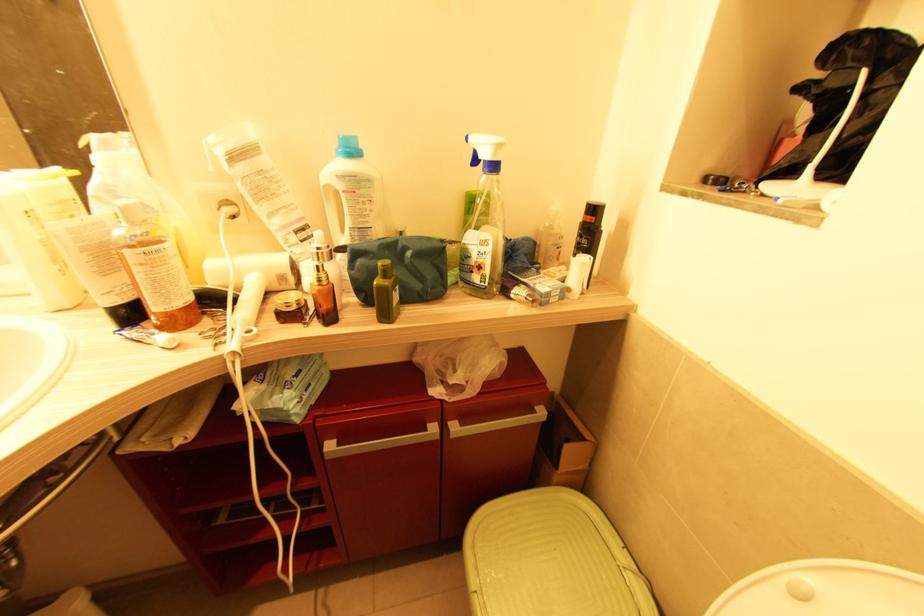
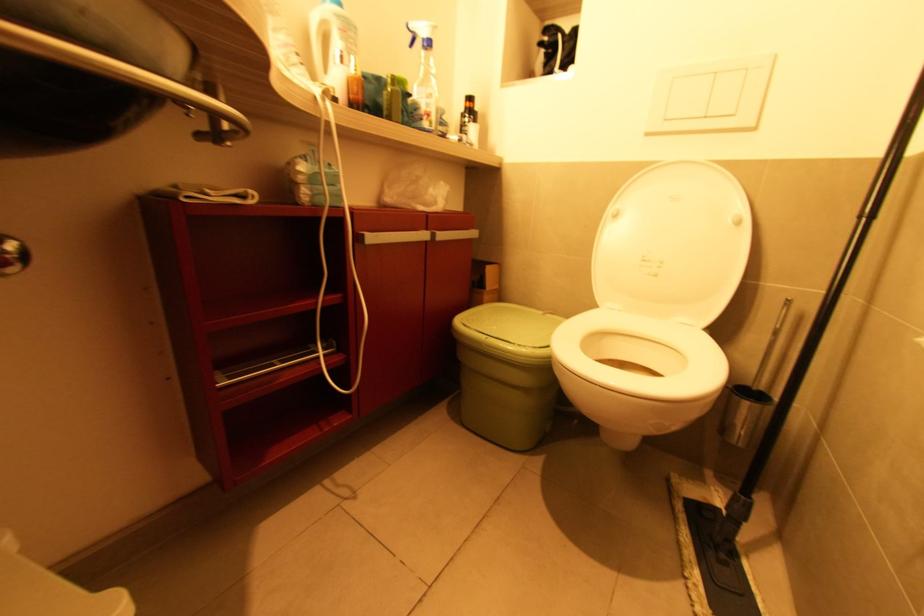
In the second image, find the point that corresponds to (626,570) in the first image.

(545, 314)